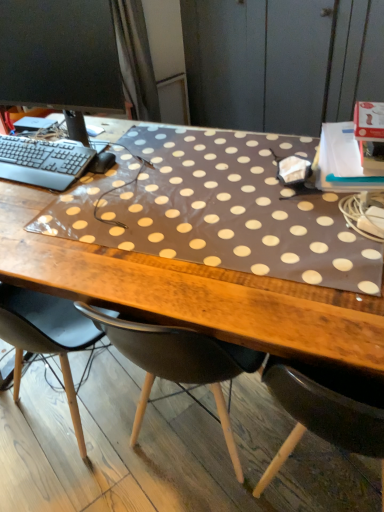
Identify the location of empty space that is to the right of black matte mouse at center. This screenshot has height=512, width=384. (148, 159).